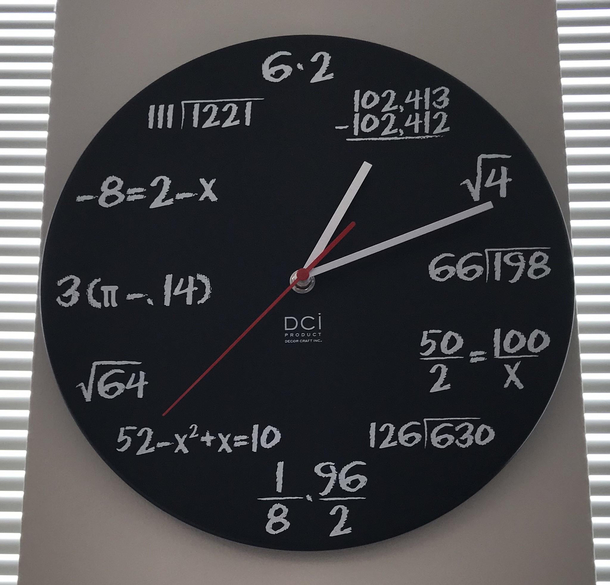
I want to click on white wall, so click(x=575, y=209).